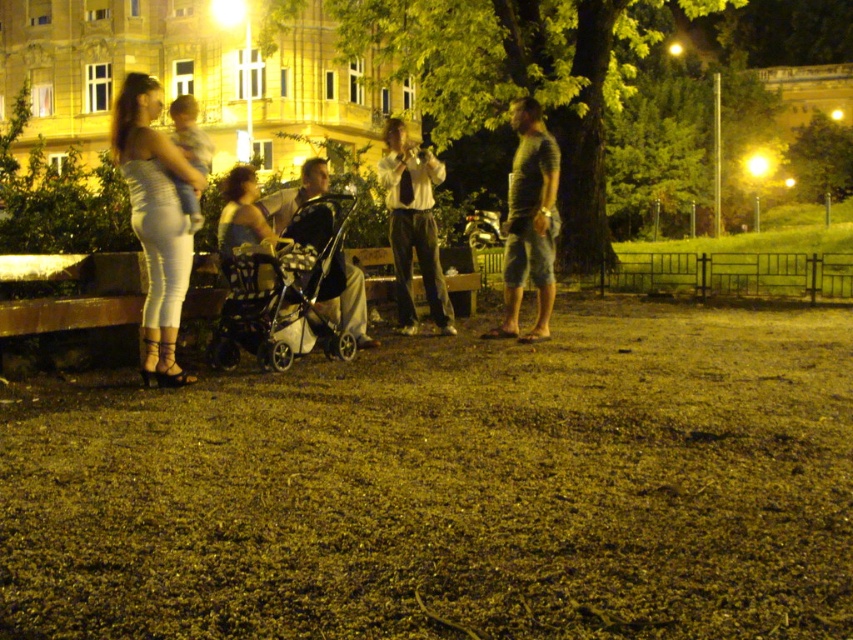
Question: Can you confirm if matte black stroller at center is wider than dark gray stroller at center?

Choices:
 (A) no
 (B) yes

Answer: (B)

Question: Is the position of black textured stroller at center less distant than that of white shirt at center?

Choices:
 (A) no
 (B) yes

Answer: (B)

Question: Which of the following is the farthest from the observer?

Choices:
 (A) (390, 189)
 (B) (166, 225)

Answer: (A)

Question: Which point is farther to the camera?

Choices:
 (A) matte black stroller at center
 (B) black textured stroller at center
 (C) striped t-shirt at center
 (D) dark gray stroller at center

Answer: (C)

Question: Can you confirm if matte white pants at left is positioned to the left of striped t-shirt at center?

Choices:
 (A) no
 (B) yes

Answer: (B)

Question: Estimate the real-world distances between objects in this image. Which object is closer to the black textured stroller at center?

Choices:
 (A) matte black stroller at center
 (B) white shirt at center
 (C) matte white pants at left
 (D) striped t-shirt at center

Answer: (A)